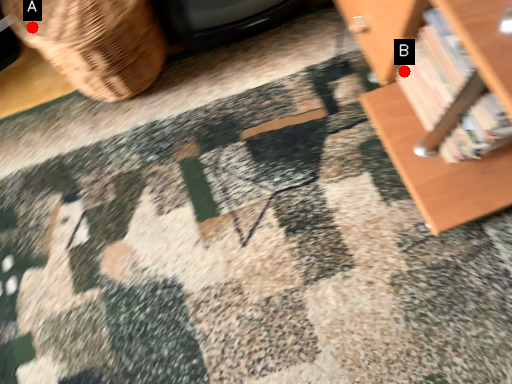
Question: Two points are circled on the image, labeled by A and B beside each circle. Which point is closer to the camera?

Choices:
 (A) A is closer
 (B) B is closer

Answer: (A)